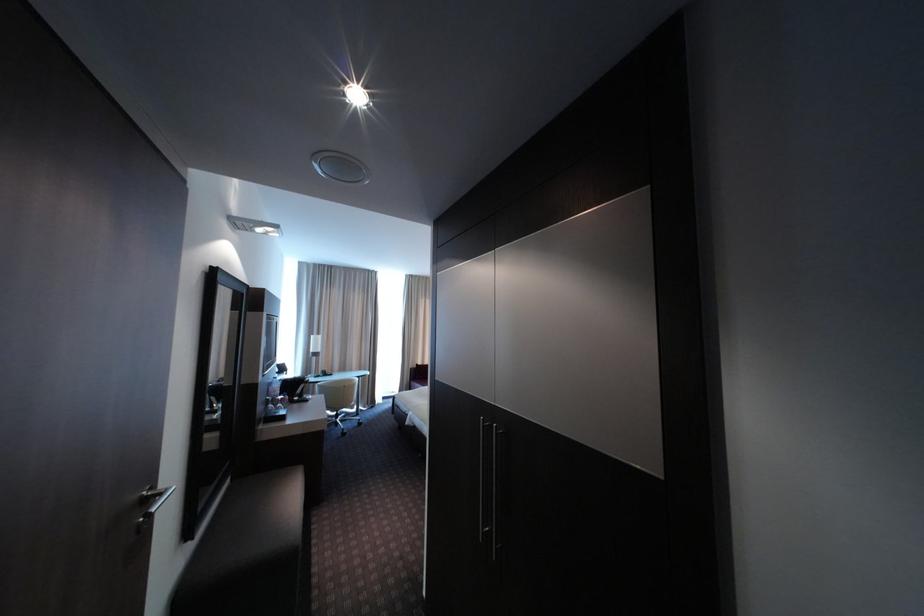
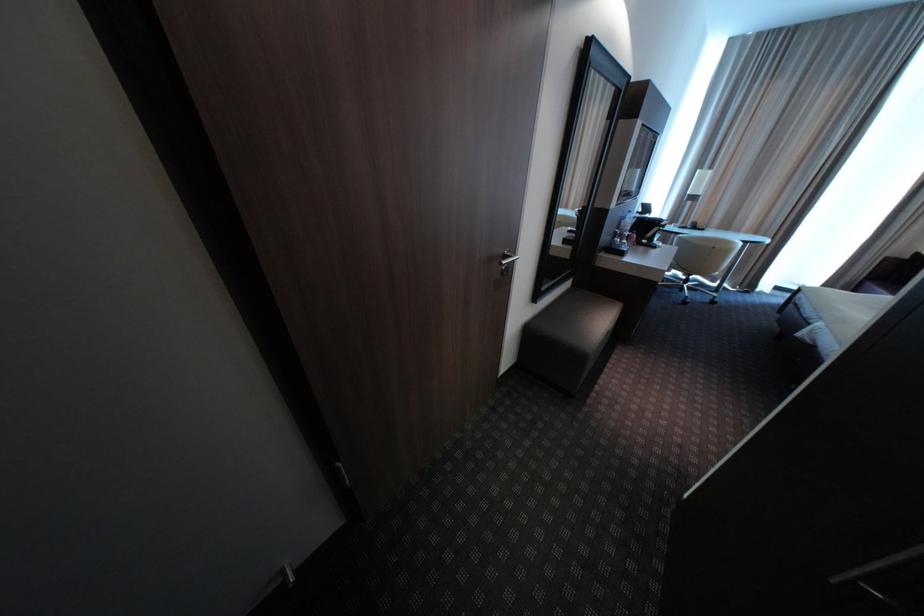
First-person continuous shooting, in which direction is the camera rotating?

The camera's rotation is toward left-down.